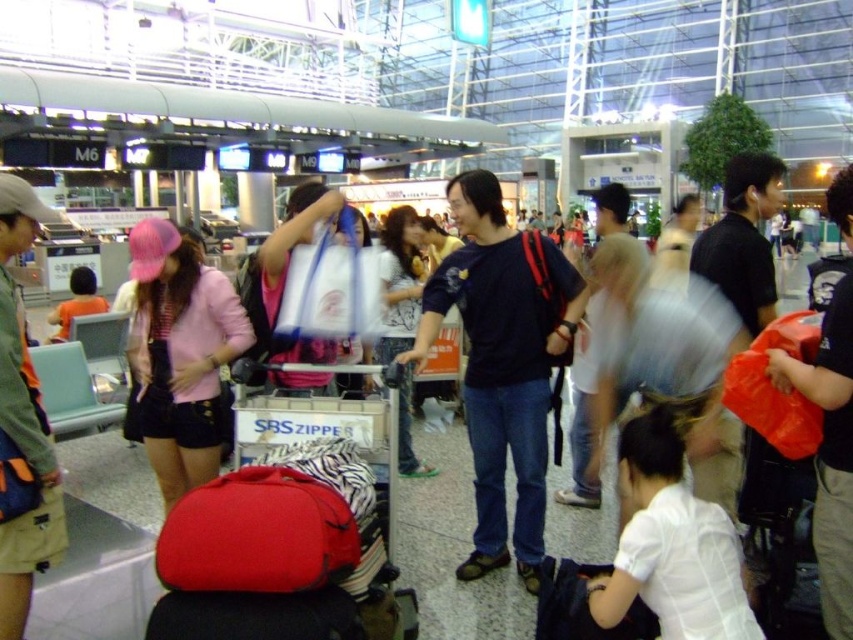
Does pink knitted hat at left lie behind denim jeans at center?

That is False.

Is point (183, 276) less distant than point (386, 243)?

Yes, point (183, 276) is closer to viewer.

The width and height of the screenshot is (853, 640). I want to click on pink knitted hat at left, so (181, 355).

Is pink knitted hat at left closer to the viewer compared to white matte shirt at lower center?

That is False.

Is point (178, 458) farther from viewer compared to point (729, 582)?

Yes, it is.

In order to click on pink knitted hat at left in this screenshot , I will do `click(181, 355)`.

Which of these two, white matte shirt at lower center or denim jeans at center, stands shorter?

white matte shirt at lower center

Which of these two, white matte shirt at lower center or denim jeans at center, stands taller?

Standing taller between the two is denim jeans at center.

Which is behind, point (697, 589) or point (399, 452)?

Positioned behind is point (399, 452).

Find the location of a particular element. This screenshot has height=640, width=853. white matte shirt at lower center is located at coordinates (672, 545).